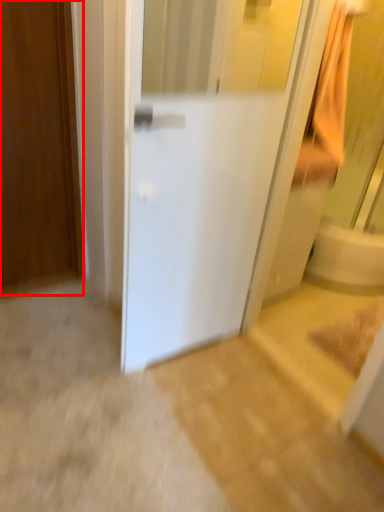
Question: Observing the image, what is the correct spatial positioning of door (annotated by the red box) in reference to door?

Choices:
 (A) right
 (B) left

Answer: (B)